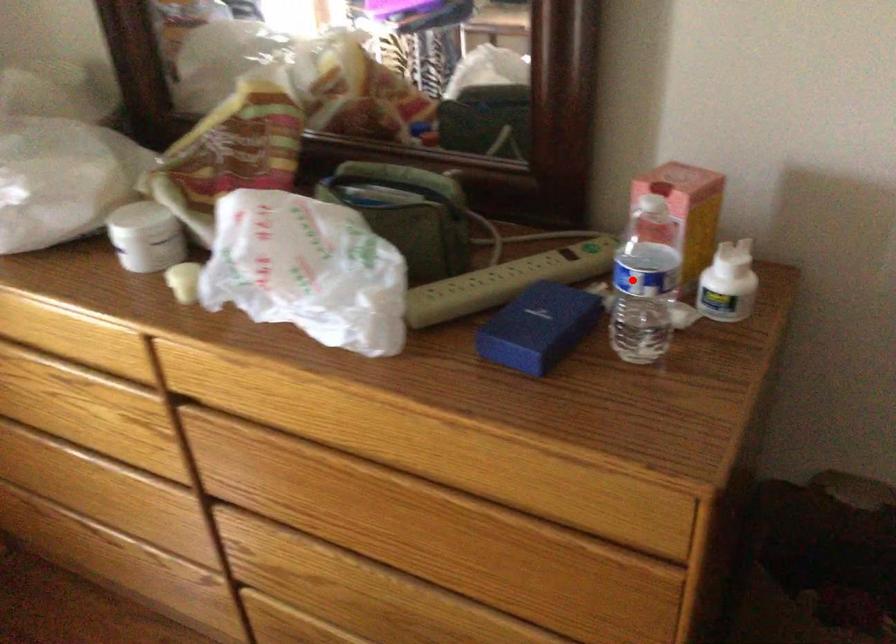
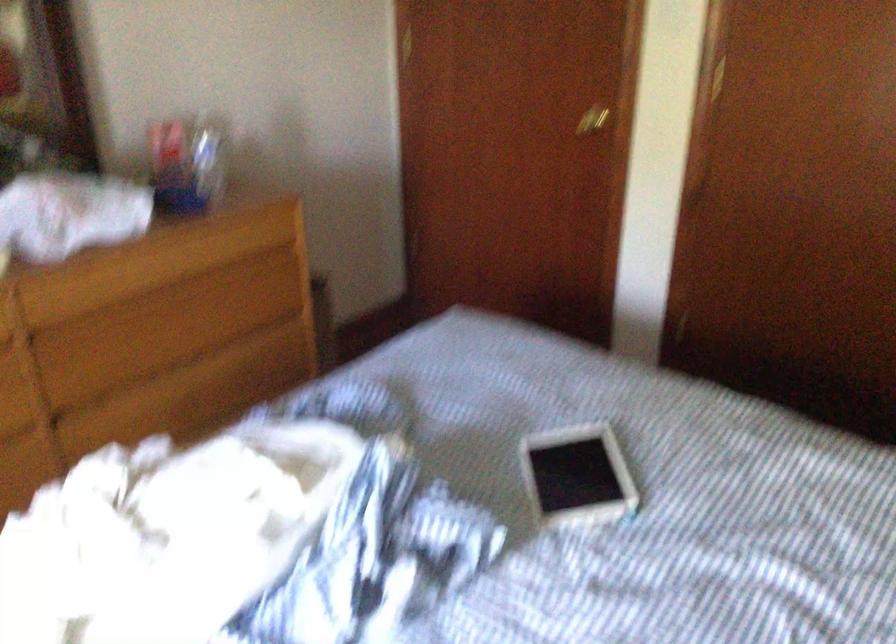
Locate, in the second image, the point that corresponds to the highlighted location in the first image.

(208, 156)